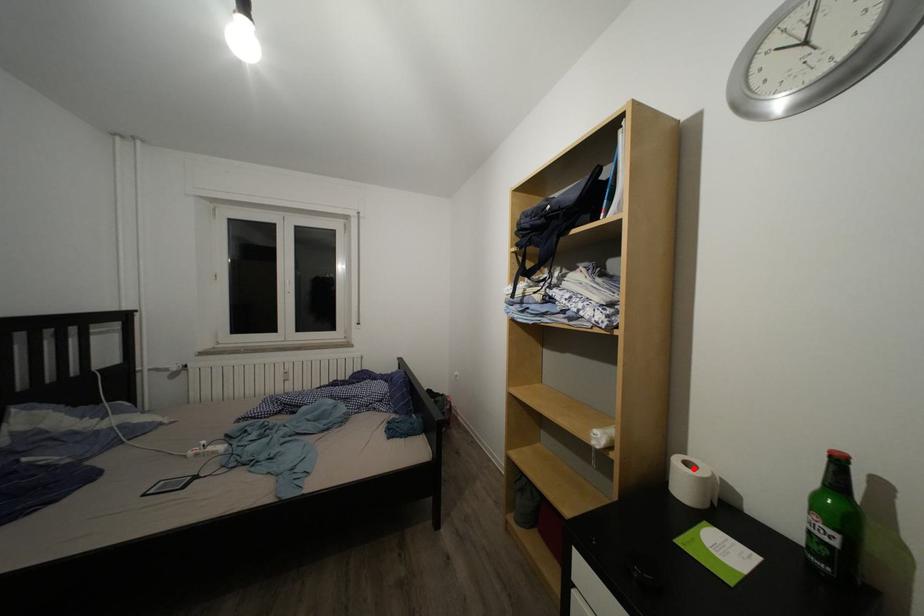
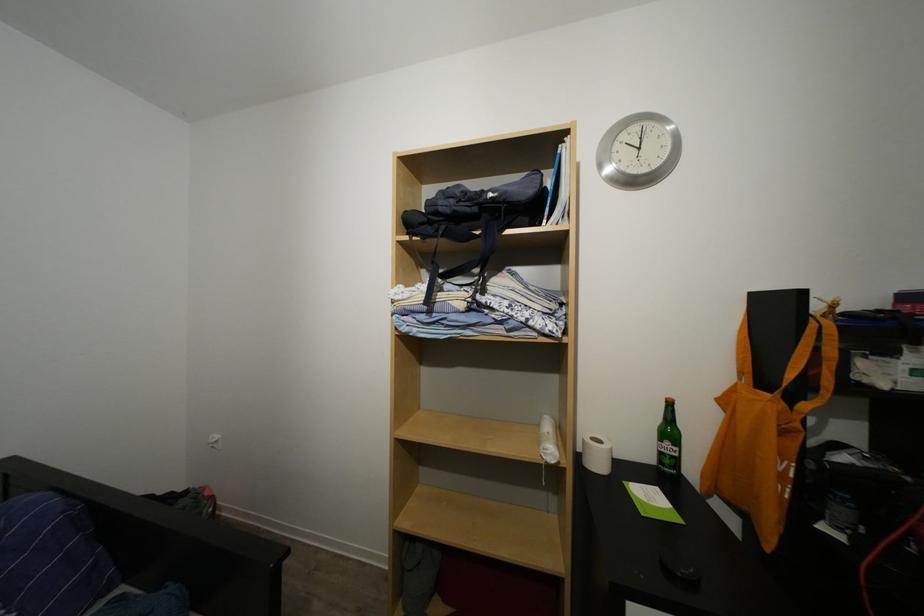
The point at the highlighted location is marked in the first image. Where is the corresponding point in the second image?

(601, 446)